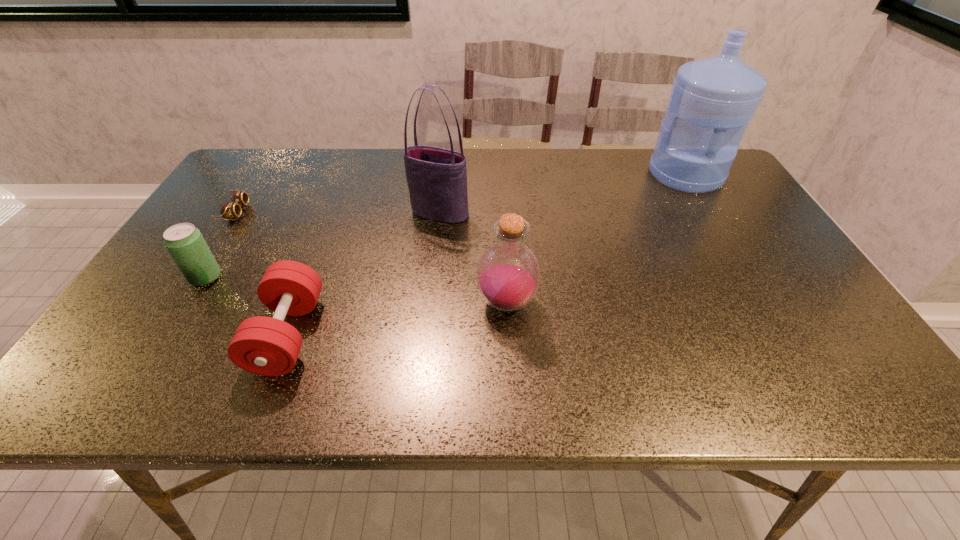
Locate an element on the screen. This screenshot has width=960, height=540. the rightmost object is located at coordinates (713, 99).

Image resolution: width=960 pixels, height=540 pixels. Identify the location of the farthest object. (713, 99).

Find the location of a particular element. tote bag is located at coordinates (437, 177).

Locate an element on the screen. The image size is (960, 540). the fourth object from left to right is located at coordinates (437, 177).

Locate an element on the screen. The height and width of the screenshot is (540, 960). the fourth shortest object is located at coordinates (508, 274).

In order to click on the fifth object from left to right in this screenshot , I will do `click(508, 274)`.

The width and height of the screenshot is (960, 540). Find the location of `soda`. soda is located at coordinates (185, 243).

You are a GUI agent. You are given a task and a screenshot of the screen. Output one action in this format:
    pyautogui.click(x=<x>, y=<y>)
    Task: Click on the fifth tallest object
    
    Given the screenshot: What is the action you would take?
    pyautogui.click(x=266, y=346)

Find the location of a particular element. The width and height of the screenshot is (960, 540). the third object from left to right is located at coordinates (266, 346).

Locate an element on the screen. the shortest object is located at coordinates (x=228, y=210).